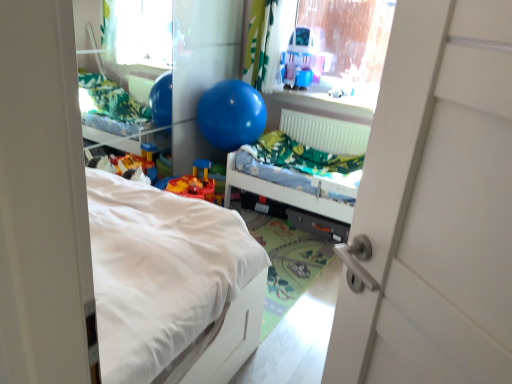
Question: Considering the relative sizes of translucent plastic playhouse at upper center and blue rubber balloon at upper center in the image provided, is translucent plastic playhouse at upper center shorter than blue rubber balloon at upper center?

Choices:
 (A) no
 (B) yes

Answer: (B)

Question: Is translucent plastic playhouse at upper center thinner than blue rubber balloon at upper center?

Choices:
 (A) no
 (B) yes

Answer: (B)

Question: Is the depth of translucent plastic playhouse at upper center less than that of blue rubber balloon at upper center?

Choices:
 (A) yes
 (B) no

Answer: (B)

Question: Is translucent plastic playhouse at upper center oriented away from blue rubber balloon at upper center?

Choices:
 (A) yes
 (B) no

Answer: (B)

Question: From a real-world perspective, does translucent plastic playhouse at upper center sit lower than blue rubber balloon at upper center?

Choices:
 (A) yes
 (B) no

Answer: (B)

Question: Can we say translucent plastic playhouse at upper center lies outside blue rubber balloon at upper center?

Choices:
 (A) no
 (B) yes

Answer: (B)

Question: Is green fabric curtain at upper center positioned in front of blue rubber ball at center?

Choices:
 (A) yes
 (B) no

Answer: (B)

Question: Is green fabric curtain at upper center next to blue rubber ball at center?

Choices:
 (A) yes
 (B) no

Answer: (B)

Question: Can you confirm if green fabric curtain at upper center is thinner than blue rubber ball at center?

Choices:
 (A) no
 (B) yes

Answer: (B)

Question: From the image's perspective, is green fabric curtain at upper center under blue rubber ball at center?

Choices:
 (A) no
 (B) yes

Answer: (A)

Question: Considering the relative positions of green fabric curtain at upper center and blue rubber ball at center in the image provided, is green fabric curtain at upper center behind blue rubber ball at center?

Choices:
 (A) no
 (B) yes

Answer: (B)

Question: Can you confirm if green fabric curtain at upper center is taller than blue rubber ball at center?

Choices:
 (A) yes
 (B) no

Answer: (A)

Question: Is green fabric curtain at upper center wider than transparent plastic window screen at upper center?

Choices:
 (A) yes
 (B) no

Answer: (A)